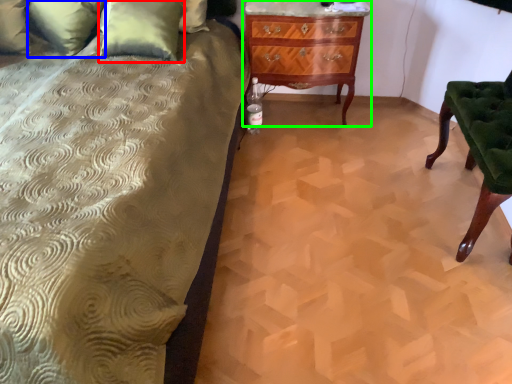
Question: Which is farther away from pillow (highlighted by a red box)? pillow (highlighted by a blue box) or chest of drawers (highlighted by a green box)?

Choices:
 (A) pillow
 (B) chest of drawers

Answer: (B)